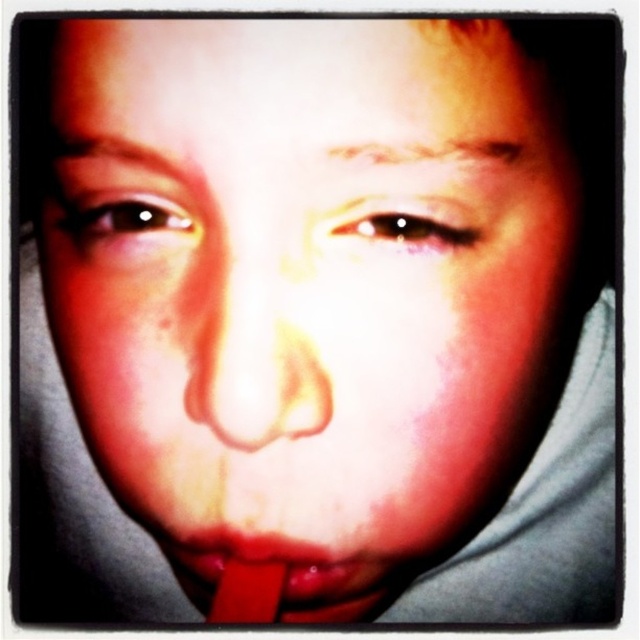
Who is more forward, (116, 198) or (364, 225)?

Positioned in front is point (364, 225).

Is brown glossy eye at upper left bigger than shiny brown eye at center?

Yes, brown glossy eye at upper left is bigger than shiny brown eye at center.

Is point (138, 205) positioned before point (406, 220)?

That is False.

Identify the location of brown glossy eye at upper left. (128, 220).

Is the position of rubber-like red at center more distant than that of brown glossy eye at upper left?

Yes, it is behind brown glossy eye at upper left.

Where is `rubber-like red at center`? rubber-like red at center is located at coordinates [x=282, y=573].

Between smooth flesh nose at center and rubber-like red at center, which one appears on the left side from the viewer's perspective?

Positioned to the left is smooth flesh nose at center.

Is point (204, 353) more distant than point (284, 563)?

No, (204, 353) is in front of (284, 563).

This screenshot has height=640, width=640. I want to click on smooth flesh nose at center, so click(250, 362).